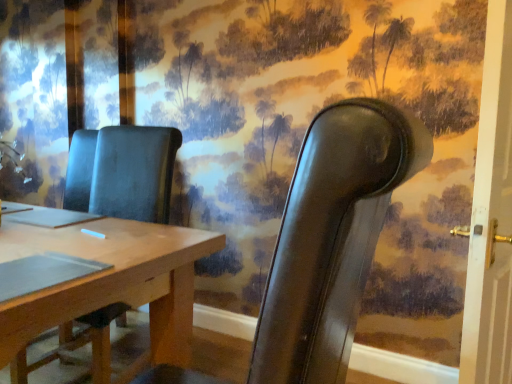
Question: Can you confirm if leather chair at right, which appears as the 1th chair when viewed from the right, is taller than white painted wood door at right?

Choices:
 (A) no
 (B) yes

Answer: (A)

Question: Is leather chair at right, acting as the 2th chair starting from the left, oriented away from white painted wood door at right?

Choices:
 (A) no
 (B) yes

Answer: (A)

Question: Considering the relative sizes of leather chair at right, which appears as the 1th chair when viewed from the right, and white painted wood door at right in the image provided, is leather chair at right, which appears as the 1th chair when viewed from the right, wider than white painted wood door at right?

Choices:
 (A) yes
 (B) no

Answer: (A)

Question: Considering the relative positions of leather chair at right, acting as the 2th chair starting from the left, and white painted wood door at right in the image provided, is leather chair at right, acting as the 2th chair starting from the left, to the right of white painted wood door at right from the viewer's perspective?

Choices:
 (A) no
 (B) yes

Answer: (A)

Question: Does leather chair at right, which appears as the 1th chair when viewed from the right, have a lesser height compared to white painted wood door at right?

Choices:
 (A) no
 (B) yes

Answer: (B)

Question: Is leather chair at right, acting as the 2th chair starting from the left, touching white painted wood door at right?

Choices:
 (A) yes
 (B) no

Answer: (B)

Question: Considering the relative sizes of matte brown chair at center, which is counted as the 2th chair, starting from the right, and white painted wood door at right in the image provided, is matte brown chair at center, which is counted as the 2th chair, starting from the right, bigger than white painted wood door at right?

Choices:
 (A) no
 (B) yes

Answer: (B)

Question: From a real-world perspective, does matte brown chair at center, which is counted as the 2th chair, starting from the right, stand above white painted wood door at right?

Choices:
 (A) yes
 (B) no

Answer: (B)

Question: Considering the relative sizes of matte brown chair at center, which is counted as the 2th chair, starting from the right, and white painted wood door at right in the image provided, is matte brown chair at center, which is counted as the 2th chair, starting from the right, wider than white painted wood door at right?

Choices:
 (A) yes
 (B) no

Answer: (A)

Question: From the image's perspective, does matte brown chair at center, which is counted as the 2th chair, starting from the right, appear higher than white painted wood door at right?

Choices:
 (A) no
 (B) yes

Answer: (A)

Question: Is matte brown chair at center, which is counted as the 2th chair, starting from the right, turned away from white painted wood door at right?

Choices:
 (A) no
 (B) yes

Answer: (A)

Question: Can you confirm if matte brown chair at center, which is the 1th chair in left-to-right order, is positioned to the right of white painted wood door at right?

Choices:
 (A) no
 (B) yes

Answer: (A)

Question: Is white painted wood door at right shorter than matte brown chair at center, which is counted as the 2th chair, starting from the right?

Choices:
 (A) no
 (B) yes

Answer: (A)